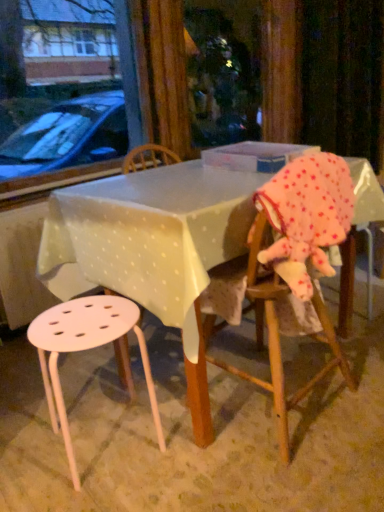
This screenshot has width=384, height=512. I want to click on vacant space underneath white plastic stool at lower left (from a real-world perspective), so click(x=104, y=442).